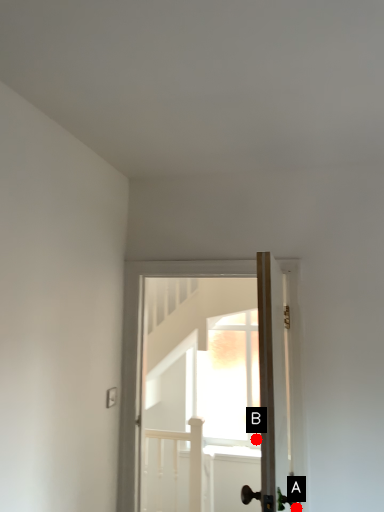
Question: Two points are circled on the image, labeled by A and B beside each circle. Which point is closer to the camera?

Choices:
 (A) A is closer
 (B) B is closer

Answer: (A)